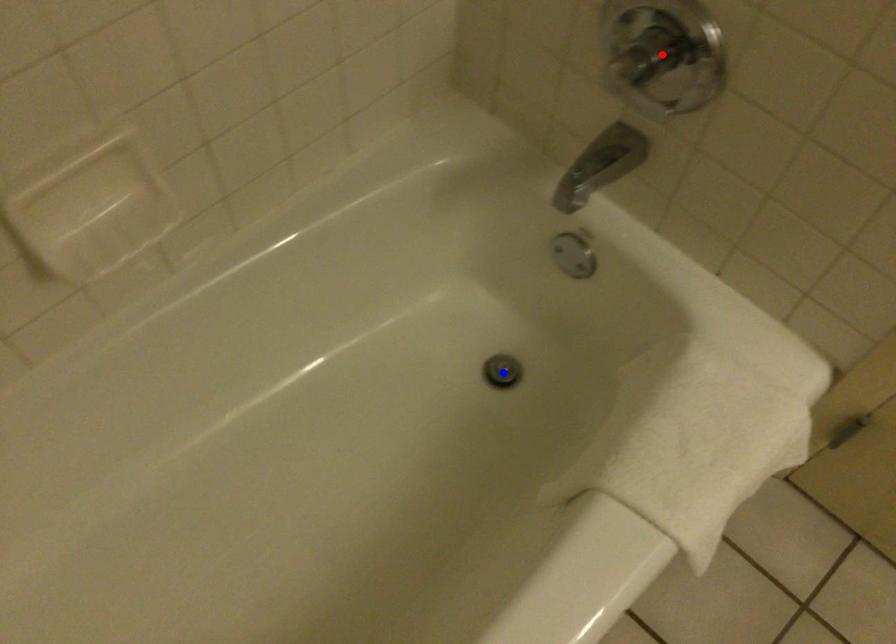
Question: Two points are marked on the image. Which point is closer to the camera?

Choices:
 (A) Blue point is closer.
 (B) Red point is closer.

Answer: (B)